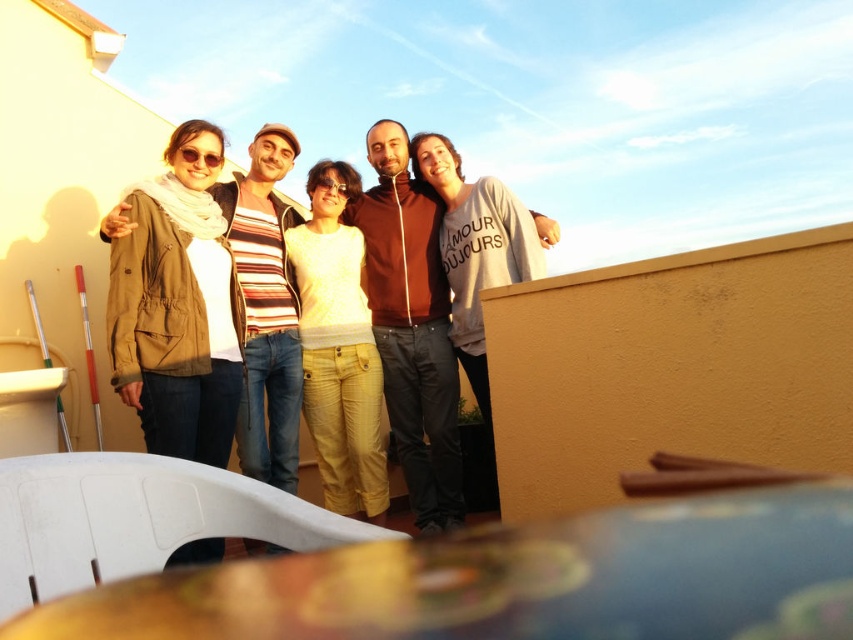
Question: Which point is farther to the camera?

Choices:
 (A) (252, 188)
 (B) (357, 332)

Answer: (A)

Question: Which point is closer to the camera?

Choices:
 (A) gray cotton sweatshirt at center
 (B) khaki cotton jacket at center
 (C) matte brown hoodie at center
 (D) light yellow corduroy pants at center

Answer: (B)

Question: Does khaki cotton jacket at center have a lesser width compared to matte brown hoodie at center?

Choices:
 (A) no
 (B) yes

Answer: (B)

Question: Which of the following is the closest to the observer?

Choices:
 (A) coord(393,260)
 (B) coord(202,176)
 (C) coord(358,458)
 (D) coord(376,296)

Answer: (B)

Question: Is matte brown jacket at center to the left of gray cotton sweatshirt at center from the viewer's perspective?

Choices:
 (A) yes
 (B) no

Answer: (A)

Question: Where is matte brown hoodie at center located in relation to light yellow corduroy pants at center in the image?

Choices:
 (A) right
 (B) left

Answer: (A)